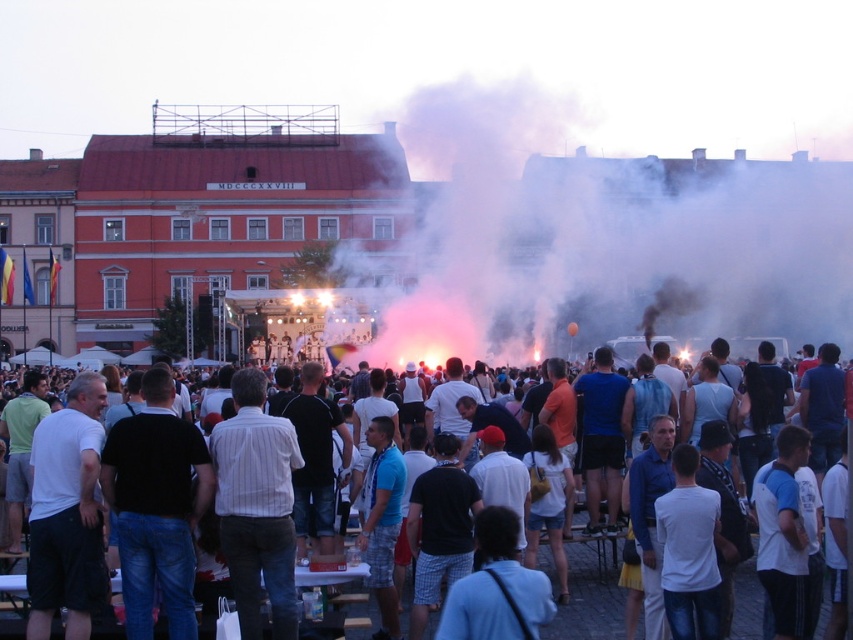
Does pink smoke at center appear on the right side of white cotton crowd at center?

Yes, pink smoke at center is to the right of white cotton crowd at center.

Between point (656, 269) and point (741, 572), which one is positioned behind?

Point (656, 269)

What are the coordinates of `pink smoke at center` in the screenshot? It's located at (610, 241).